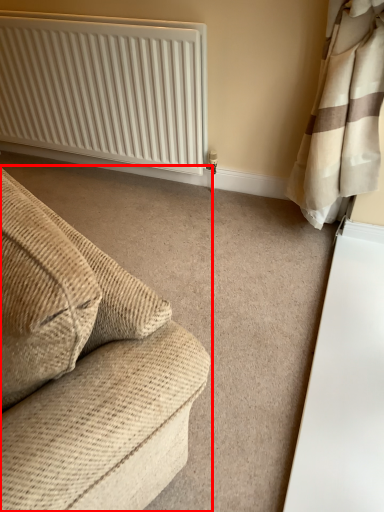
Question: From the image's perspective, what is the correct spatial relationship of studio couch (annotated by the red box) in relation to radiator?

Choices:
 (A) below
 (B) above

Answer: (A)